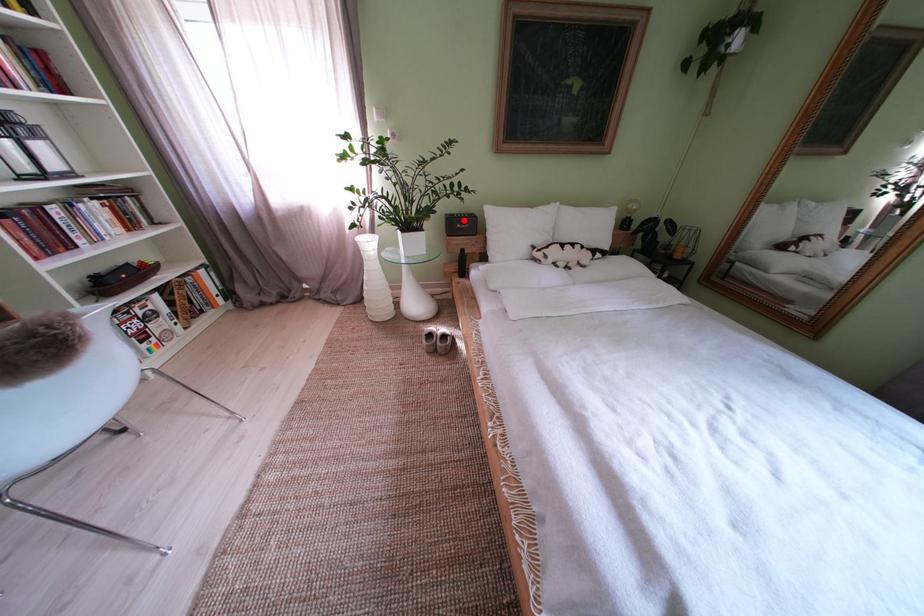
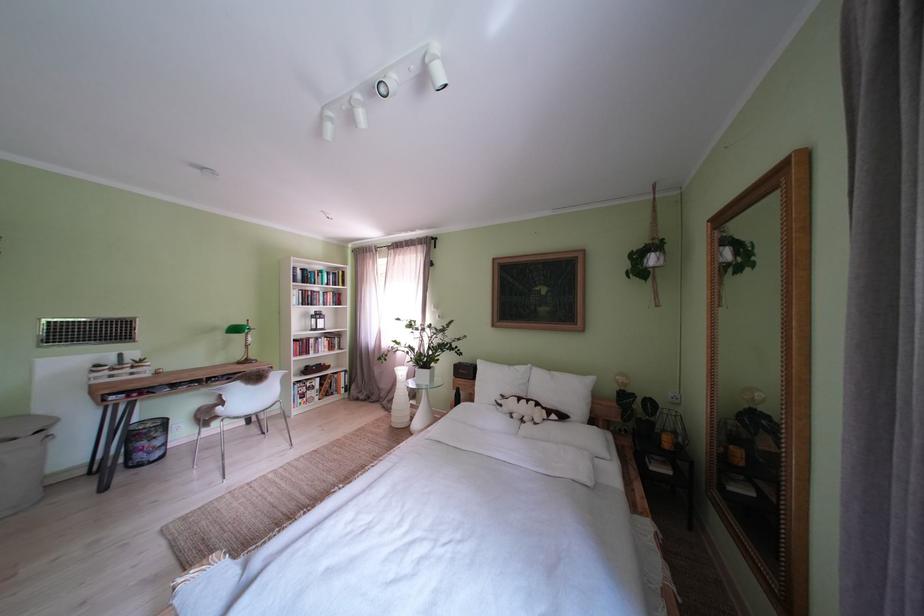
Where in the second image is the point corresponding to the highlighted location from the first image?

(472, 369)